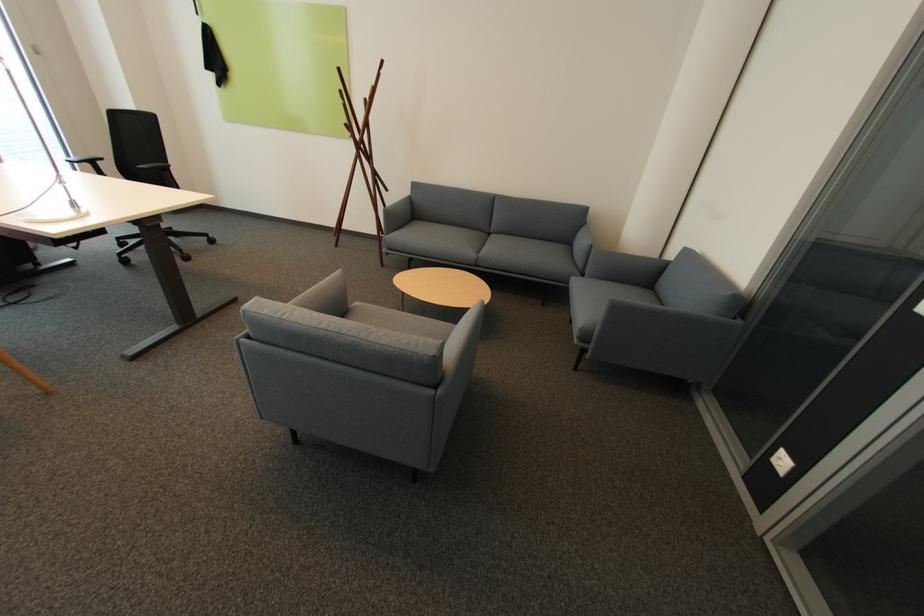
Image resolution: width=924 pixels, height=616 pixels. In order to click on black chair armrest in this screenshot , I will do `click(155, 166)`.